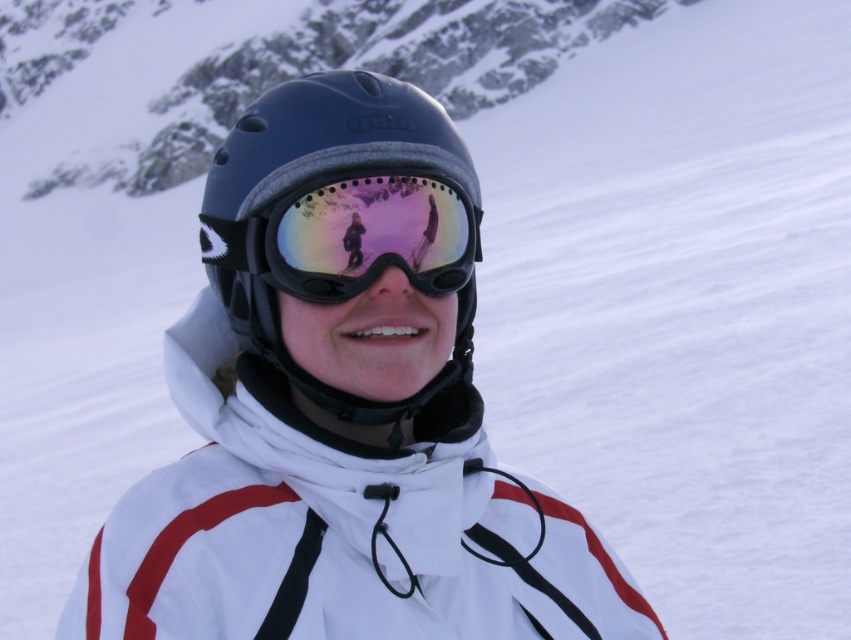
From the picture: You are designing a headrest for a car seat that needs to accommodate both the matte black helmet at center and the reflective plastic goggles at center. Since the helmet is taller, where should the headrest be positioned to ensure both items are supported?

The headrest should be positioned higher to accommodate the greater height of the matte black helmet at center, which will also provide sufficient support for the reflective plastic goggles at center since they are shorter.

You are a photographer trying to capture the reflection of the mountain in the reflective plastic goggles at center. Since the matte black helmet at center is blocking the view, can you move the helmet to the right to get a clearer shot?

The matte black helmet at center is to the left of reflective plastic goggles at center, so moving the helmet to the right would allow it to no longer block the view of the reflective plastic goggles at center, thus providing a clearer shot.